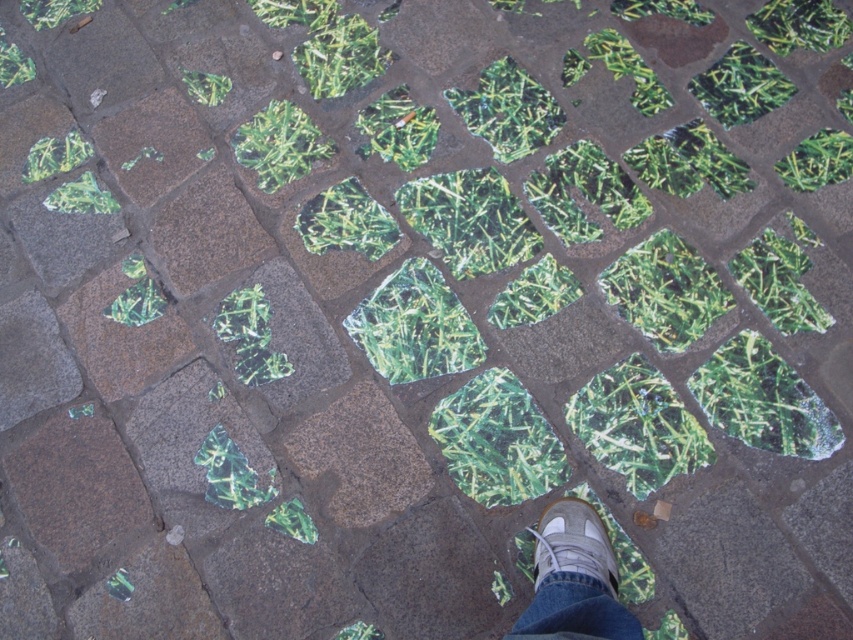
Question: Among these points, which one is nearest to the camera?

Choices:
 (A) (546, 512)
 (B) (593, 600)

Answer: (B)

Question: Can you confirm if gray suede shoe at center is positioned to the right of light brown suede shoe at center?

Choices:
 (A) yes
 (B) no

Answer: (B)

Question: Among these points, which one is farthest from the camera?

Choices:
 (A) (567, 596)
 (B) (595, 556)

Answer: (B)

Question: Among these objects, which one is farthest from the camera?

Choices:
 (A) gray suede shoe at center
 (B) light brown suede shoe at center

Answer: (B)

Question: Is gray suede shoe at center wider than light brown suede shoe at center?

Choices:
 (A) no
 (B) yes

Answer: (B)

Question: Is gray suede shoe at center closer to the viewer compared to light brown suede shoe at center?

Choices:
 (A) no
 (B) yes

Answer: (B)